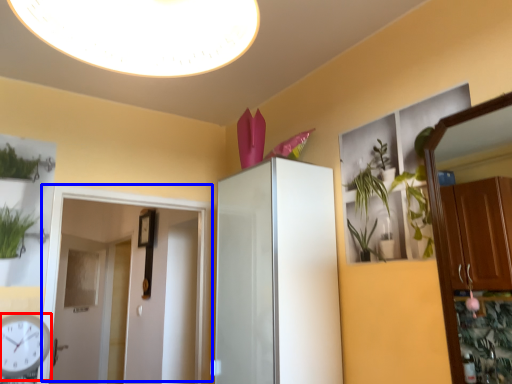
Question: Which object appears closest to the camera in this image, clock (highlighted by a red box) or door (highlighted by a blue box)?

Choices:
 (A) clock
 (B) door

Answer: (A)